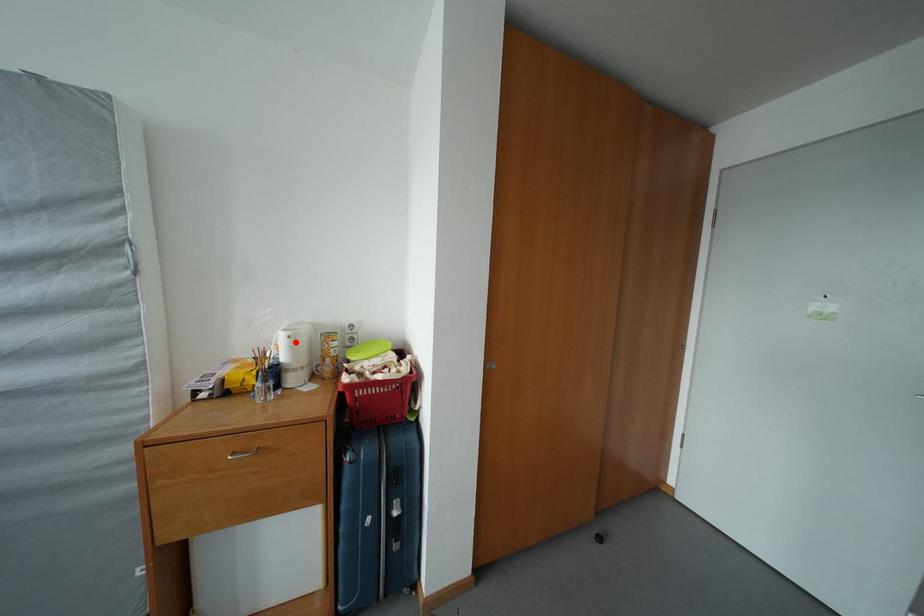
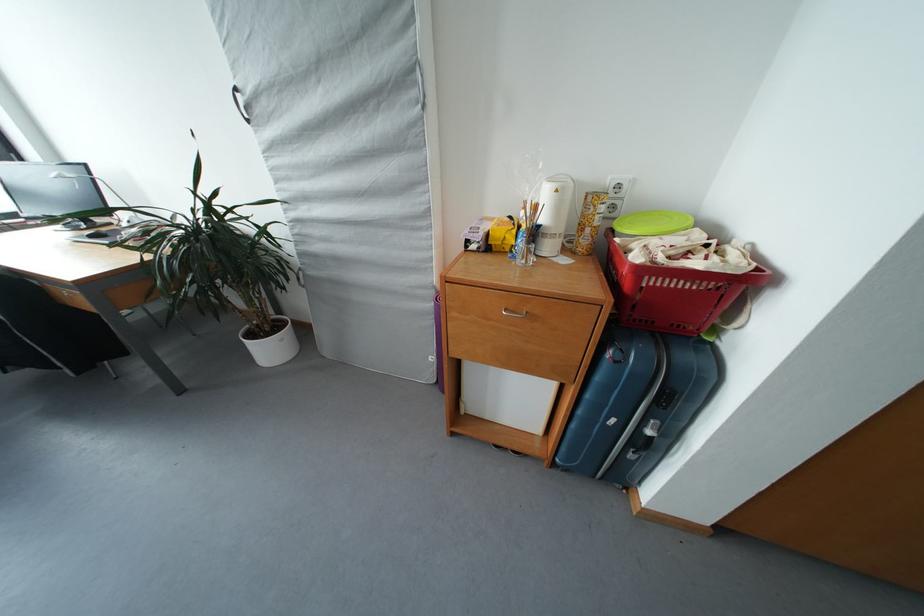
In the second image, find the point that corresponds to the highlighted location in the first image.

(563, 196)